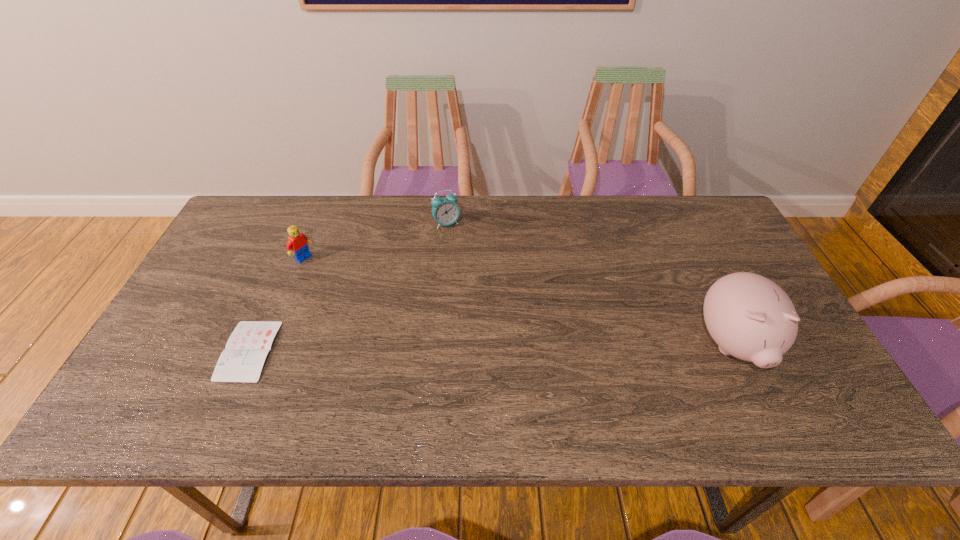
The height and width of the screenshot is (540, 960). I want to click on the shortest object, so click(x=242, y=360).

This screenshot has height=540, width=960. In order to click on the tallest object in this screenshot , I will do `click(750, 317)`.

Where is `the rightmost object`? the rightmost object is located at coordinates (750, 317).

At what (x,y) coordinates should I click in order to perform the action: click on alarm clock. Please return your answer as a coordinate pair (x, y). Image resolution: width=960 pixels, height=540 pixels. Looking at the image, I should click on (445, 211).

Identify the location of the second object from right to left. This screenshot has width=960, height=540. [x=445, y=211].

At what (x,y) coordinates should I click in order to perform the action: click on Lego. Please return your answer as a coordinate pair (x, y). The width and height of the screenshot is (960, 540). Looking at the image, I should click on (297, 244).

Identify the location of vacant space located on the right of the diary. (321, 350).

Locate an element on the screen. Image resolution: width=960 pixels, height=540 pixels. vacant space located 0.100m on the face of the farthest object is located at coordinates (469, 247).

I want to click on vacant space situated 0.240m on the face of the farthest object, so click(495, 275).

At what (x,y) coordinates should I click in order to perform the action: click on vacant position located 0.280m on the face of the farthest object. Please return your answer as a coordinate pair (x, y). Looking at the image, I should click on (503, 285).